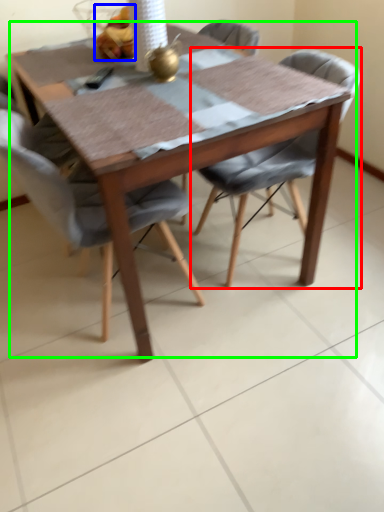
Question: Considering the real-world distances, which object is farthest from chair (highlighted by a red box)? food (highlighted by a blue box) or kitchen & dining room table (highlighted by a green box)?

Choices:
 (A) food
 (B) kitchen & dining room table

Answer: (A)